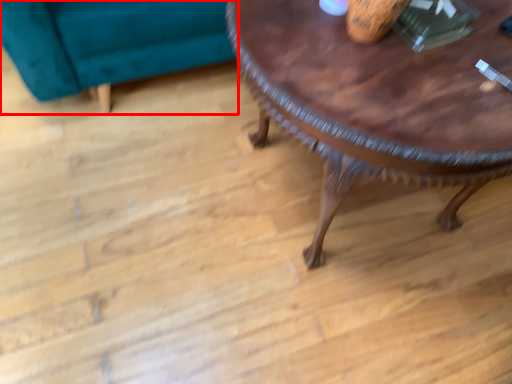
Question: From the image's perspective, what is the correct spatial relationship of swivel chair (annotated by the red box) in relation to coffee table?

Choices:
 (A) below
 (B) above

Answer: (B)